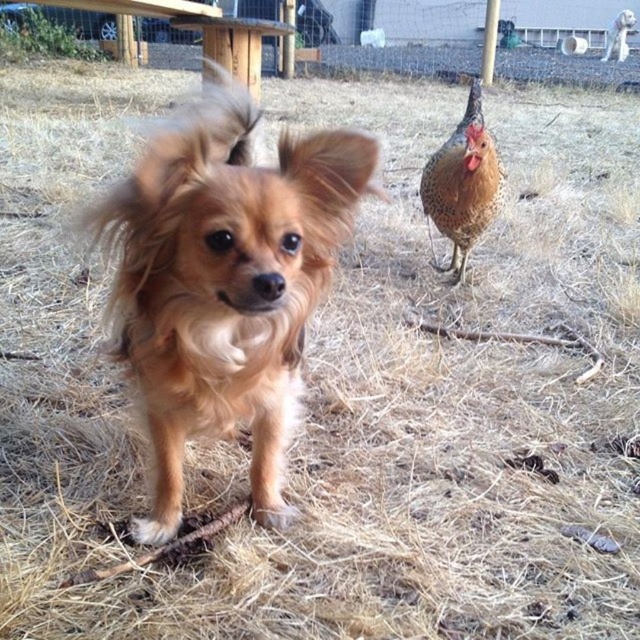
You are a photographer trying to capture both the brown fluffy dog at center and the brown speckled feathers at upper right in a single shot. Based on their positions, will the chicken be visible behind the dog in your photo?

Yes, the chicken will be visible behind the dog because the brown fluffy dog at center is in front of the brown speckled feathers at upper right, so the chicken is positioned behind the dog and should be partially visible in the background.

You are a photographer trying to capture both the brown fluffy dog at center and the brown speckled feathers at upper right in a single frame. Given their sizes, which one should you focus on to ensure both are clearly visible in the photo?

Since the brown fluffy dog at center is larger than the brown speckled feathers at upper right, you should focus on the brown fluffy dog at center to ensure both are clearly visible in the photo.

You are a farmer who needs to retrieve an egg from the chicken located at the upper right. The dog is known to chase poultry. Can you safely walk from the brown fluffy dog at center to the brown speckled feathers at upper right without the dog interfering?

The distance between the brown fluffy dog at center and the brown speckled feathers at upper right is 4.70 feet. Since the dog is known to chase poultry, this distance may be too close for the farmer to safely retrieve the egg without the dog reacting. It is advisable to secure the dog before approaching the chicken.